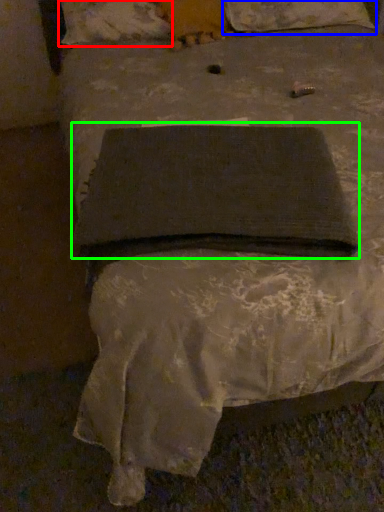
Question: Which object is positioned farthest from pillow (highlighted by a red box)? Select from pillow (highlighted by a blue box) and pad (highlighted by a green box).

Choices:
 (A) pillow
 (B) pad

Answer: (B)